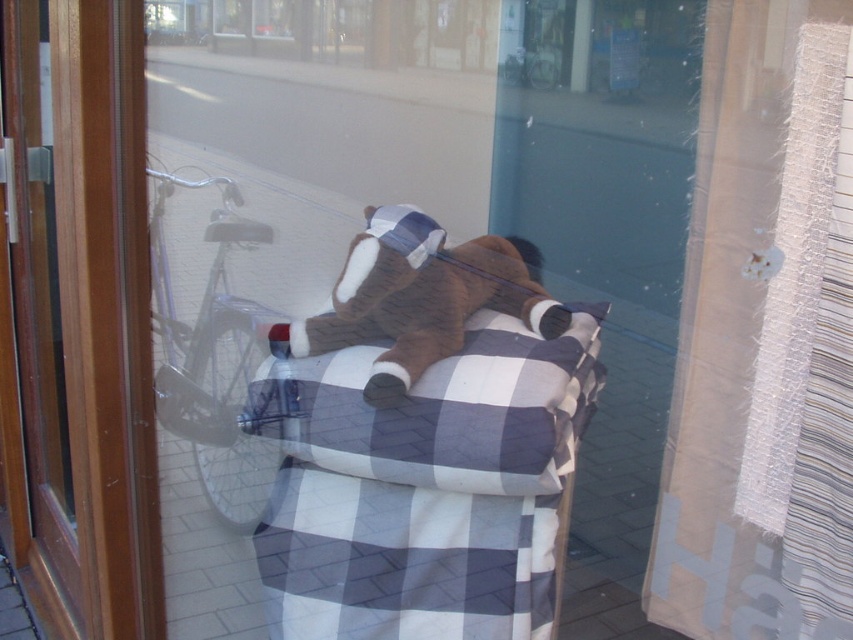
You are a customer entering the shop and see the checkered fabric blanket at center and the brown plush toy at center. Which object is taller?

The checkered fabric blanket at center is taller than the brown plush toy at center.

You are standing inside the shop looking through the window. Where is the textured beige curtain at right located in relation to the window frame?

The textured beige curtain at right is located at the right side of the window frame, as its 2D coordinates at point (744, 310) place it near the right edge of the window.